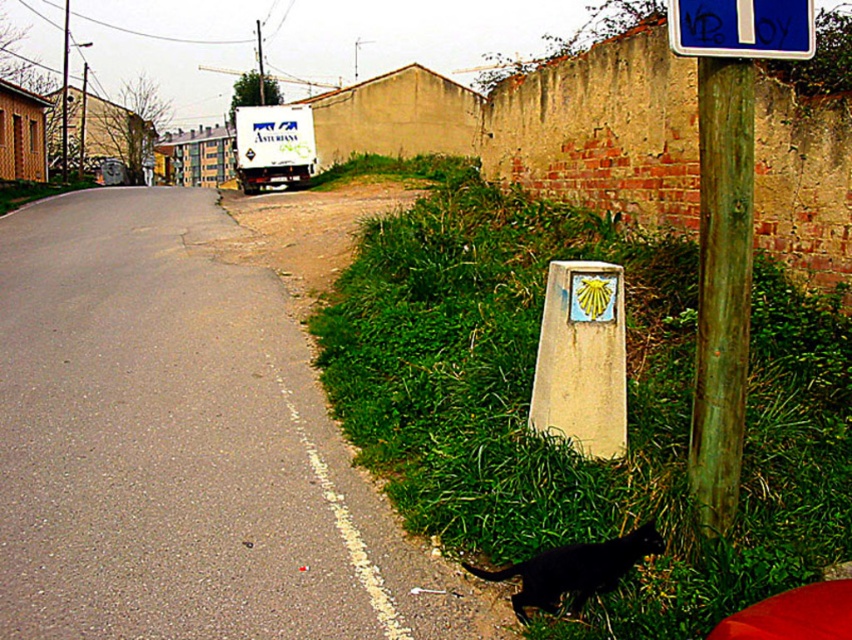
Can you confirm if wooden post at upper right is positioned above black fur cat at lower right?

Indeed, wooden post at upper right is positioned over black fur cat at lower right.

Who is more forward, (707, 420) or (574, 556)?

Point (574, 556)

Does point (703, 192) come farther from viewer compared to point (626, 550)?

That is True.

Find the location of a particular element. wooden post at upper right is located at coordinates (727, 220).

Does green grass at lower right appear over green wood pole at right?

Yes, green grass at lower right is above green wood pole at right.

Does green grass at lower right have a larger size compared to green wood pole at right?

Yes, green grass at lower right is bigger than green wood pole at right.

Find the location of a particular element. This screenshot has height=640, width=852. green grass at lower right is located at coordinates (563, 442).

Between gray asphalt road at lower left and wooden post at upper right, which one appears on the right side from the viewer's perspective?

From the viewer's perspective, wooden post at upper right appears more on the right side.

This screenshot has height=640, width=852. I want to click on gray asphalt road at lower left, so click(x=182, y=445).